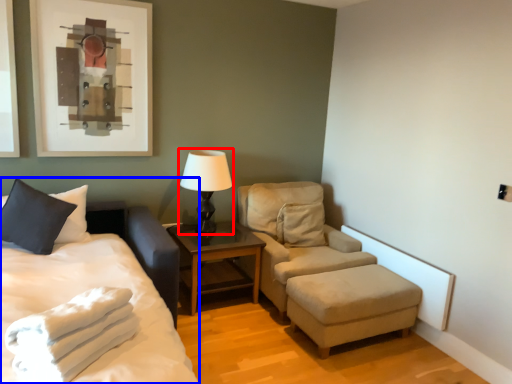
Question: Which object appears farthest to the camera in this image, table lamp (highlighted by a red box) or bed (highlighted by a blue box)?

Choices:
 (A) table lamp
 (B) bed

Answer: (A)